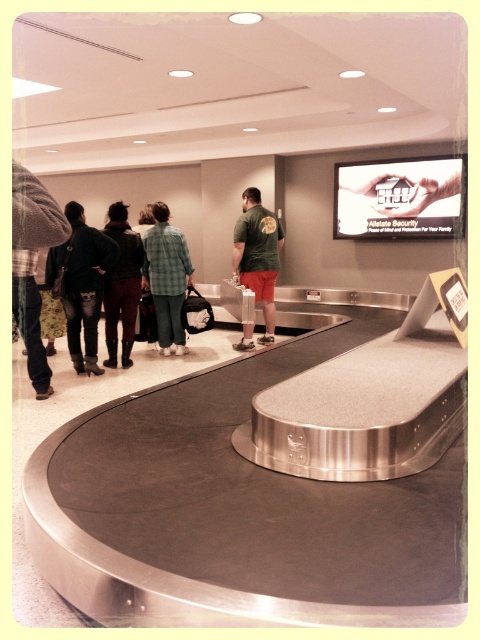
Question: Can you confirm if green plaid shirt at center is wider than green matte shirt at center?

Choices:
 (A) no
 (B) yes

Answer: (A)

Question: Which point is closer to the camera taking this photo?

Choices:
 (A) (63, 257)
 (B) (136, 268)

Answer: (A)

Question: Does green plaid shirt at center appear on the left side of green matte shirt at center?

Choices:
 (A) yes
 (B) no

Answer: (A)

Question: Which point is farther from the camera taking this photo?

Choices:
 (A) (85, 308)
 (B) (115, 218)

Answer: (B)

Question: Estimate the real-world distances between objects in this image. Which object is closer to the dark green leather jacket at left?

Choices:
 (A) denim jacket at left
 (B) green plaid shirt at center
 (C) green matte shirt at center

Answer: (A)

Question: From the image, what is the correct spatial relationship of denim jacket at left in relation to green plaid shirt at center?

Choices:
 (A) above
 (B) below

Answer: (B)